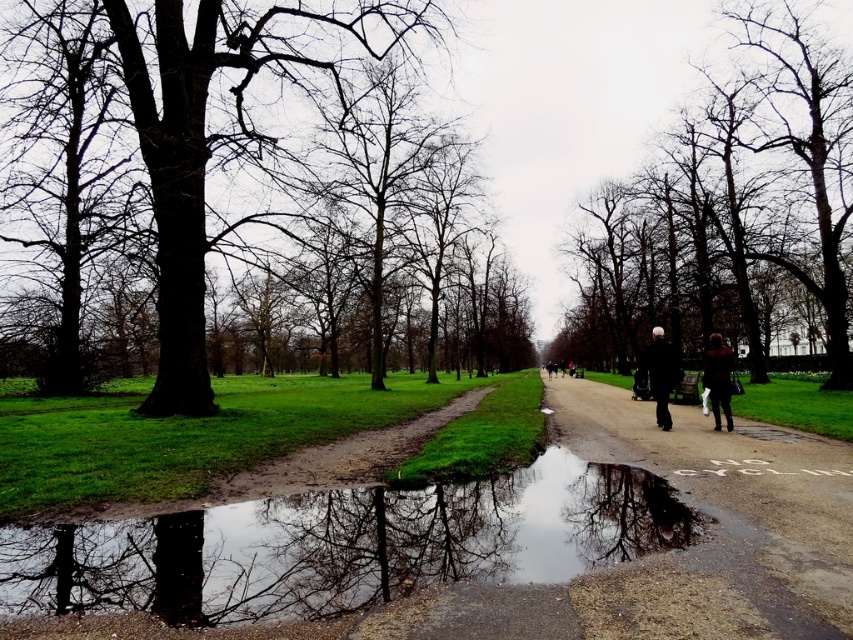
Which is more to the right, transparent water at lower center or dark brown bark tree at left?

Positioned to the right is transparent water at lower center.

Can you confirm if transparent water at lower center is positioned to the left of dark brown bark tree at left?

In fact, transparent water at lower center is to the right of dark brown bark tree at left.

Does point (527, 580) come farther from viewer compared to point (323, 113)?

No, it is not.

Identify the location of transparent water at lower center. (346, 545).

Describe the element at coordinates (346, 545) in the screenshot. I see `transparent water at lower center` at that location.

At what (x,y) coordinates should I click in order to perform the action: click on transparent water at lower center. Please return your answer as a coordinate pair (x, y). This screenshot has height=640, width=853. Looking at the image, I should click on coord(346,545).

What are the coordinates of `transparent water at lower center` in the screenshot? It's located at (346, 545).

In the scene shown: Is the position of transparent water at lower center less distant than that of dark brown leather jacket at center-right?

Yes, it is in front of dark brown leather jacket at center-right.

Is point (331, 529) farther from viewer compared to point (717, 381)?

That is False.

Between point (577, 464) and point (717, 339), which one is positioned in front?

Positioned in front is point (577, 464).

What are the coordinates of `transparent water at lower center` in the screenshot? It's located at (346, 545).